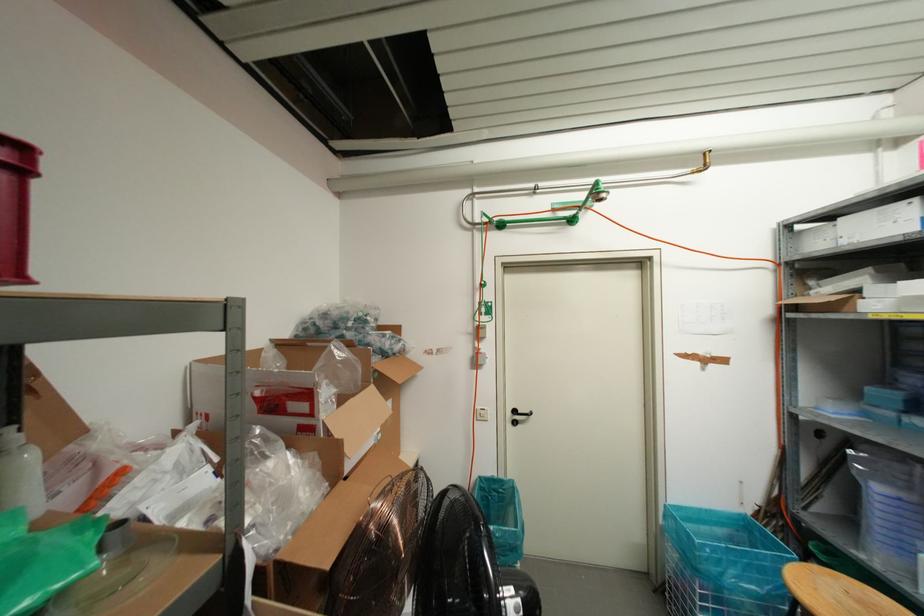
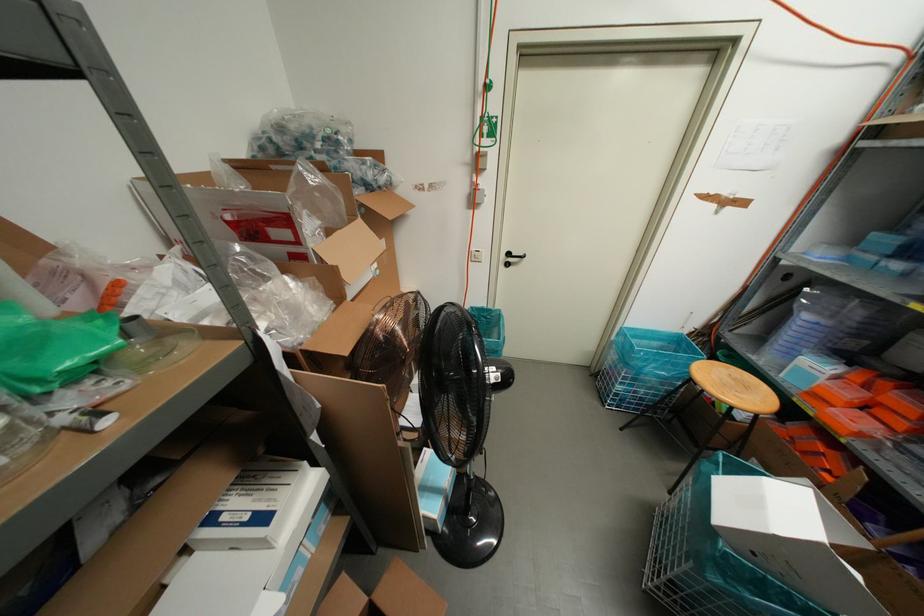
Question: Based on the continuous images, in which direction is the camera rotating? Reply with the corresponding letter.

Choices:
 (A) Left
 (B) Right
 (C) Up
 (D) Down

Answer: (D)